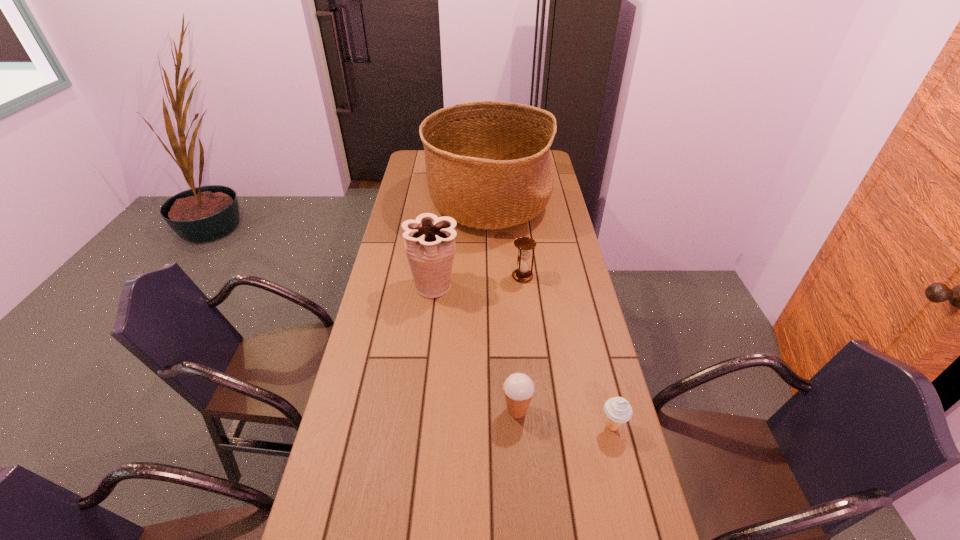
Identify the location of the tallest object. (488, 165).

This screenshot has height=540, width=960. I want to click on basket, so click(488, 165).

You are a GUI agent. You are given a task and a screenshot of the screen. Output one action in this format:
    pyautogui.click(x=<x>, y=<y>)
    Task: Click on the urn
    This screenshot has width=960, height=540.
    Given the screenshot: What is the action you would take?
    pyautogui.click(x=429, y=241)

Locate an element on the screen. The height and width of the screenshot is (540, 960). hourglass is located at coordinates (524, 244).

Where is `the left icecream`? This screenshot has width=960, height=540. the left icecream is located at coordinates (518, 388).

Locate an element on the screen. The image size is (960, 540). the right icecream is located at coordinates (618, 410).

Locate an element on the screen. vacant space located on the front of the tallest object is located at coordinates (491, 299).

This screenshot has width=960, height=540. What are the coordinates of `vacant space positioned 0.060m on the left of the fourth shortest object` in the screenshot? It's located at (392, 286).

The image size is (960, 540). What are the coordinates of `vacant area situated on the front of the hourglass` in the screenshot? It's located at (526, 313).

The image size is (960, 540). Identify the location of vacant region located on the left of the left icecream. coord(355,410).